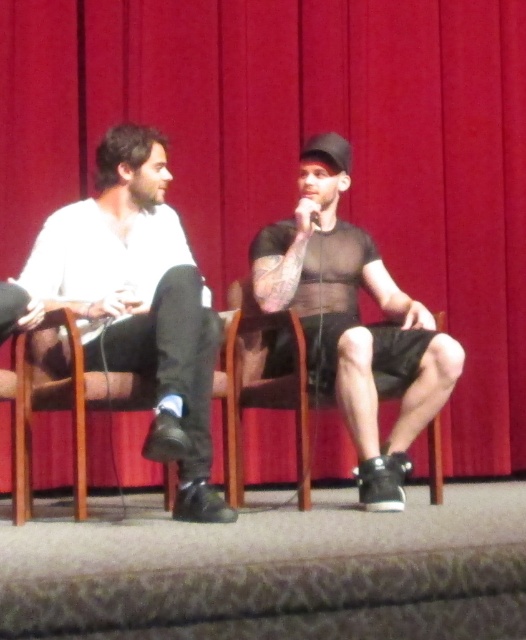
Question: Does matte black shirt at center have a smaller size compared to black matte microphone at center?

Choices:
 (A) yes
 (B) no

Answer: (B)

Question: Which object is positioned farthest from the black matte microphone at center?

Choices:
 (A) matte black shirt at center
 (B) matte white shirt at left

Answer: (B)

Question: Is matte white shirt at left in front of matte black shirt at center?

Choices:
 (A) yes
 (B) no

Answer: (A)

Question: Among these objects, which one is farthest from the camera?

Choices:
 (A) black matte microphone at center
 (B) matte white shirt at left
 (C) matte black shirt at center

Answer: (A)

Question: Observing the image, what is the correct spatial positioning of matte white shirt at left in reference to black matte microphone at center?

Choices:
 (A) below
 (B) above

Answer: (A)

Question: Based on their relative distances, which object is nearer to the matte white shirt at left?

Choices:
 (A) matte black shirt at center
 (B) black matte microphone at center

Answer: (A)